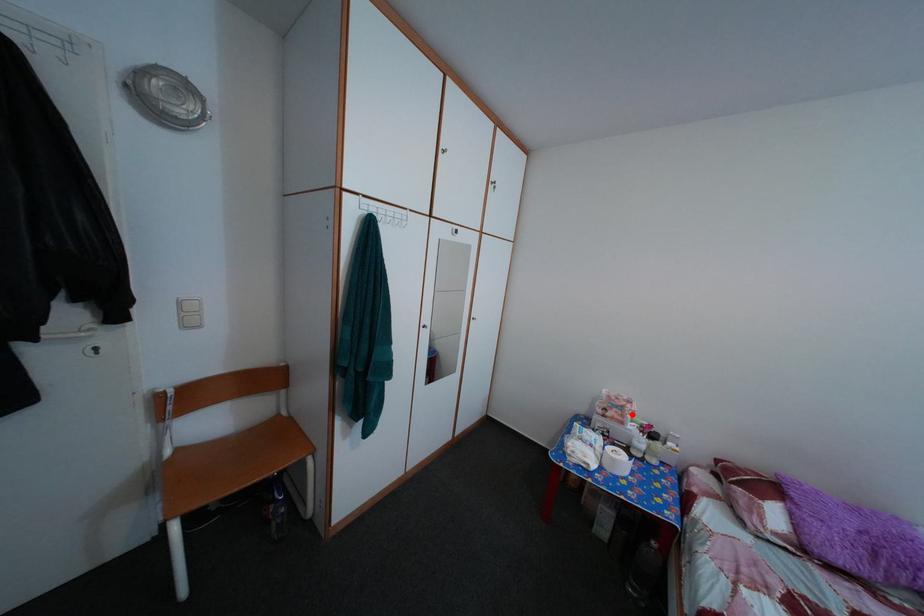
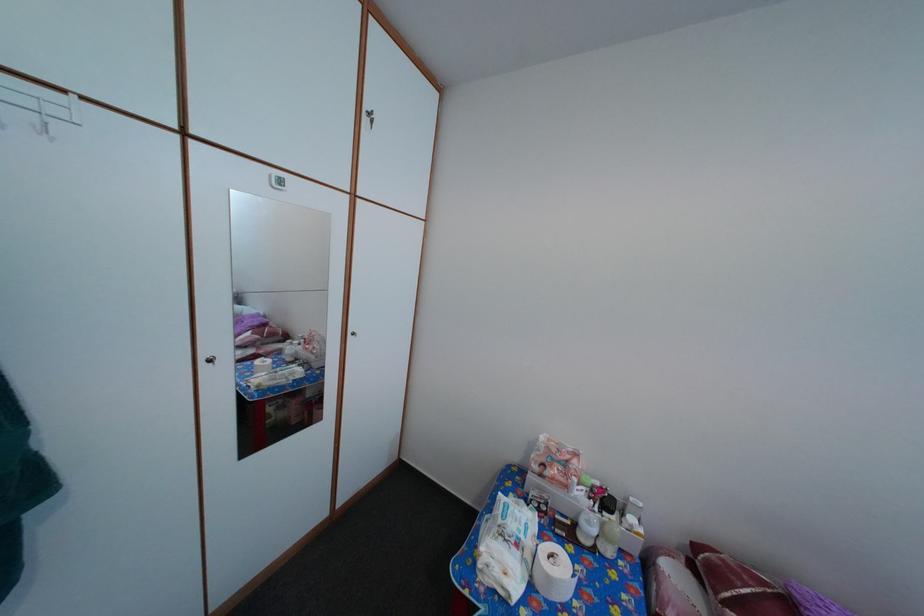
In the second image, find the point that corresponds to the highlighted location in the first image.

(576, 469)